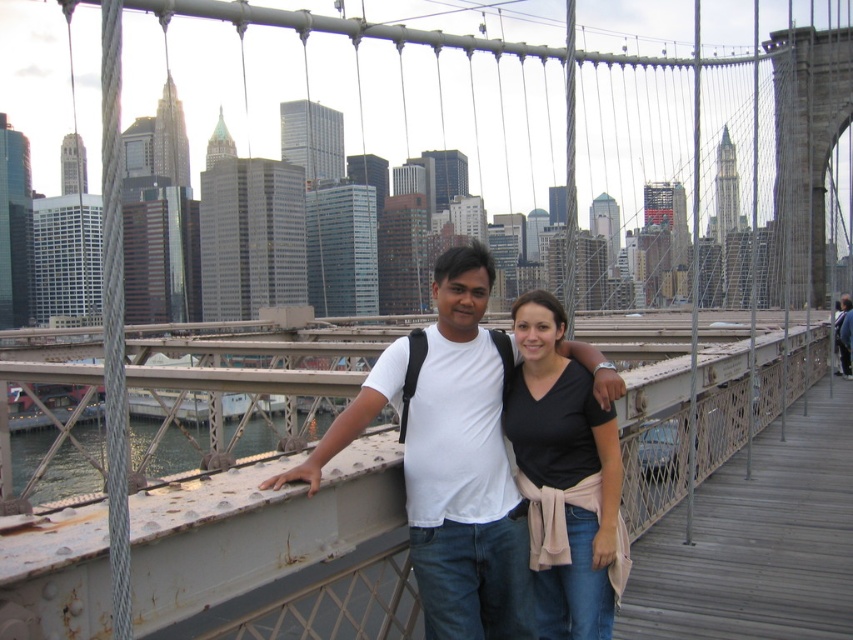
Question: Is white matte t-shirt at center closer to the viewer compared to black cotton shirt at center?

Choices:
 (A) yes
 (B) no

Answer: (A)

Question: Which of the following is the farthest from the observer?

Choices:
 (A) black cotton shirt at center
 (B) white matte t-shirt at center

Answer: (A)

Question: Which point is farther from the camera taking this photo?

Choices:
 (A) (618, 531)
 (B) (480, 275)

Answer: (B)

Question: Does white matte t-shirt at center have a larger size compared to black cotton shirt at center?

Choices:
 (A) yes
 (B) no

Answer: (A)

Question: Can you confirm if white matte t-shirt at center is positioned above black cotton shirt at center?

Choices:
 (A) no
 (B) yes

Answer: (B)